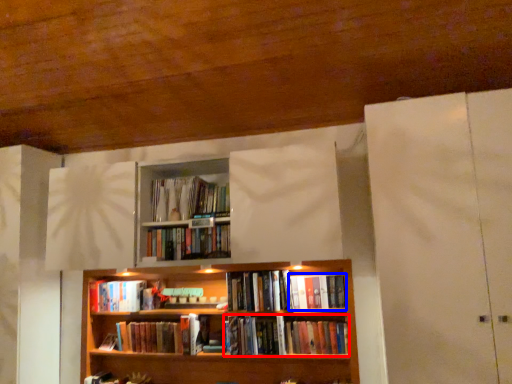
Question: Which point is further to the camera, book (highlighted by a red box) or book (highlighted by a blue box)?

Choices:
 (A) book
 (B) book

Answer: (B)